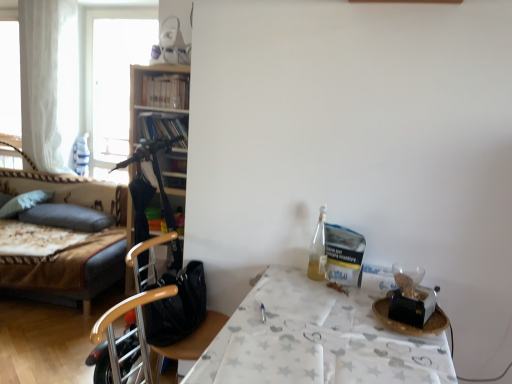
Question: Considering the relative sizes of dark gray fabric pillow at left, the 1th pillow when ordered from right to left, and white paper table at right in the image provided, is dark gray fabric pillow at left, the 1th pillow when ordered from right to left, smaller than white paper table at right?

Choices:
 (A) yes
 (B) no

Answer: (A)

Question: Considering the relative positions of dark gray fabric pillow at left, the 1th pillow when ordered from right to left, and white paper table at right in the image provided, is dark gray fabric pillow at left, the 1th pillow when ordered from right to left, to the left of white paper table at right from the viewer's perspective?

Choices:
 (A) yes
 (B) no

Answer: (A)

Question: Can you confirm if dark gray fabric pillow at left, the 1th pillow when ordered from right to left, is taller than white paper table at right?

Choices:
 (A) yes
 (B) no

Answer: (B)

Question: From a real-world perspective, is dark gray fabric pillow at left, the 1th pillow when ordered from right to left, under white paper table at right?

Choices:
 (A) yes
 (B) no

Answer: (B)

Question: Are dark gray fabric pillow at left, the 1th pillow when ordered from right to left, and white paper table at right making contact?

Choices:
 (A) yes
 (B) no

Answer: (B)

Question: Is point (5, 210) positioned closer to the camera than point (194, 334)?

Choices:
 (A) farther
 (B) closer

Answer: (A)

Question: In the image, is soft gray pillow at left, the first pillow viewed from the left, positioned in front of or behind wooden chair at center?

Choices:
 (A) behind
 (B) front

Answer: (A)

Question: From the image's perspective, is soft gray pillow at left, acting as the 2th pillow starting from the right, above or below wooden chair at center?

Choices:
 (A) below
 (B) above

Answer: (B)

Question: In terms of width, does soft gray pillow at left, acting as the 2th pillow starting from the right, look wider or thinner when compared to wooden chair at center?

Choices:
 (A) wide
 (B) thin

Answer: (B)

Question: Does point (5, 203) appear closer or farther from the camera than point (92, 167)?

Choices:
 (A) closer
 (B) farther

Answer: (A)

Question: Is soft gray pillow at left, acting as the 2th pillow starting from the right, wider or thinner than transparent glass window at upper left?

Choices:
 (A) thin
 (B) wide

Answer: (B)

Question: Considering the relative positions of soft gray pillow at left, the first pillow viewed from the left, and transparent glass window at upper left in the image provided, is soft gray pillow at left, the first pillow viewed from the left, to the left or to the right of transparent glass window at upper left?

Choices:
 (A) left
 (B) right

Answer: (A)

Question: Relative to transparent glass window at upper left, is soft gray pillow at left, the first pillow viewed from the left, in front or behind?

Choices:
 (A) front
 (B) behind

Answer: (A)

Question: Is white paper table at right taller or shorter than transparent glass window at upper left?

Choices:
 (A) tall
 (B) short

Answer: (B)

Question: In terms of size, does white paper table at right appear bigger or smaller than transparent glass window at upper left?

Choices:
 (A) big
 (B) small

Answer: (A)